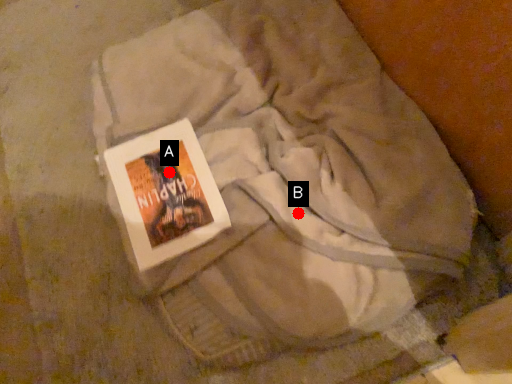
Question: Two points are circled on the image, labeled by A and B beside each circle. Which point is closer to the camera?

Choices:
 (A) A is closer
 (B) B is closer

Answer: (B)